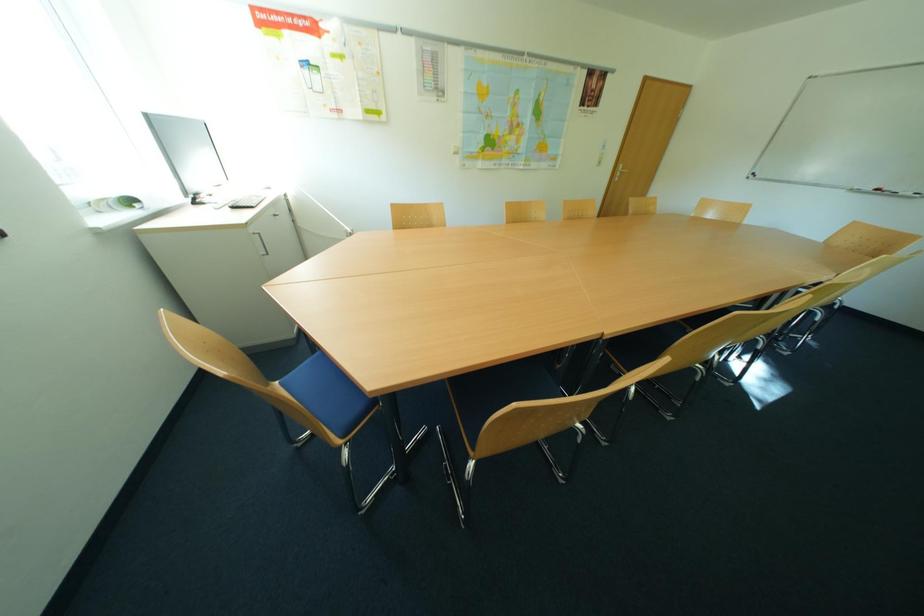
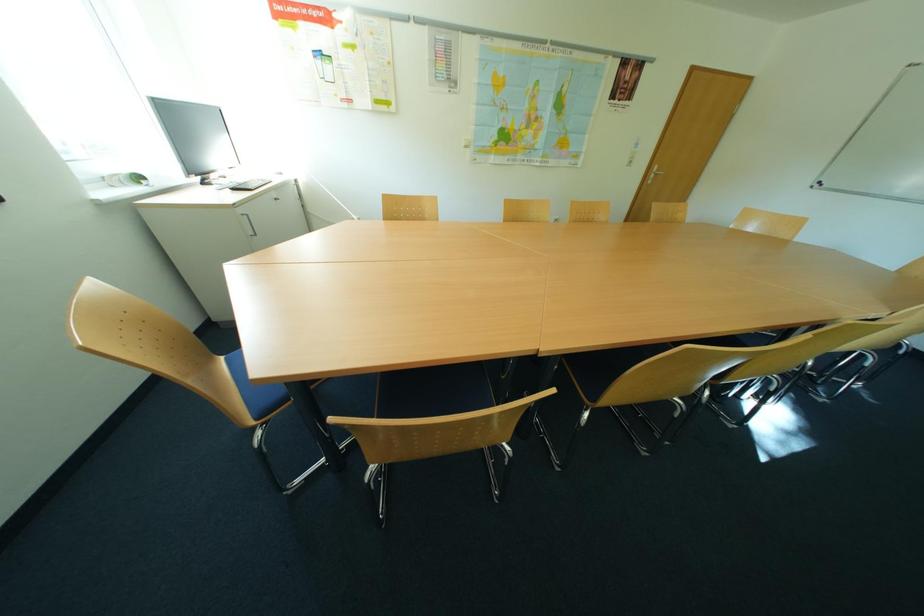
Question: In a continuous first-person perspective shot, in which direction is the camera moving?

Choices:
 (A) Left
 (B) Right
 (C) Forward
 (D) Backward

Answer: (B)